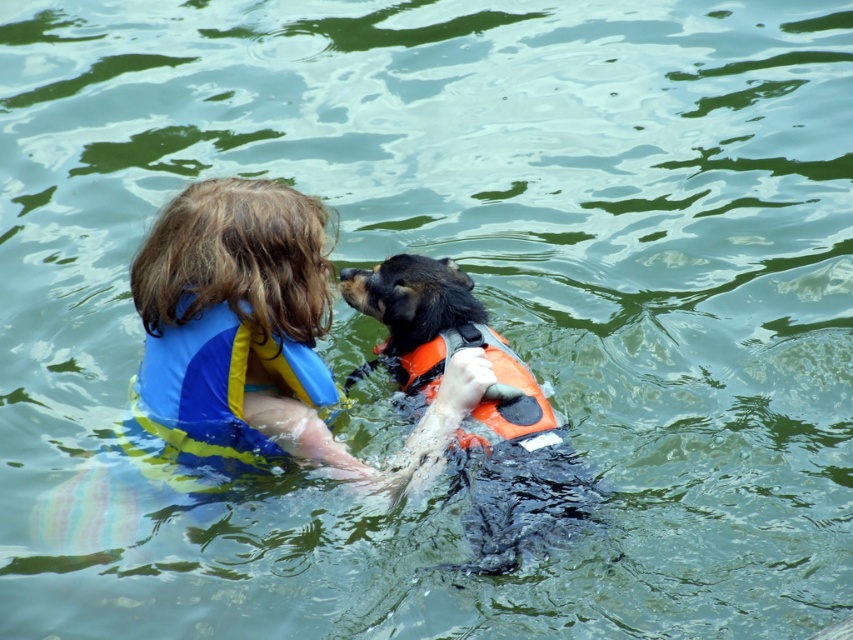
Looking at this image, you are a photographer trying to capture the child and the dog in the water. You notice two points marked in the scene. Which point is closer to the camera, point (206, 321) or point (418, 380)?

Point (206, 321) is in front of point (418, 380), so it is closer to the camera.